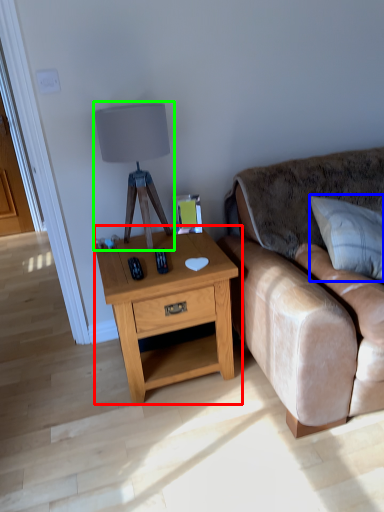
Question: Which is farther away from nightstand (highlighted by a red box)? pillow (highlighted by a blue box) or table lamp (highlighted by a green box)?

Choices:
 (A) pillow
 (B) table lamp

Answer: (A)